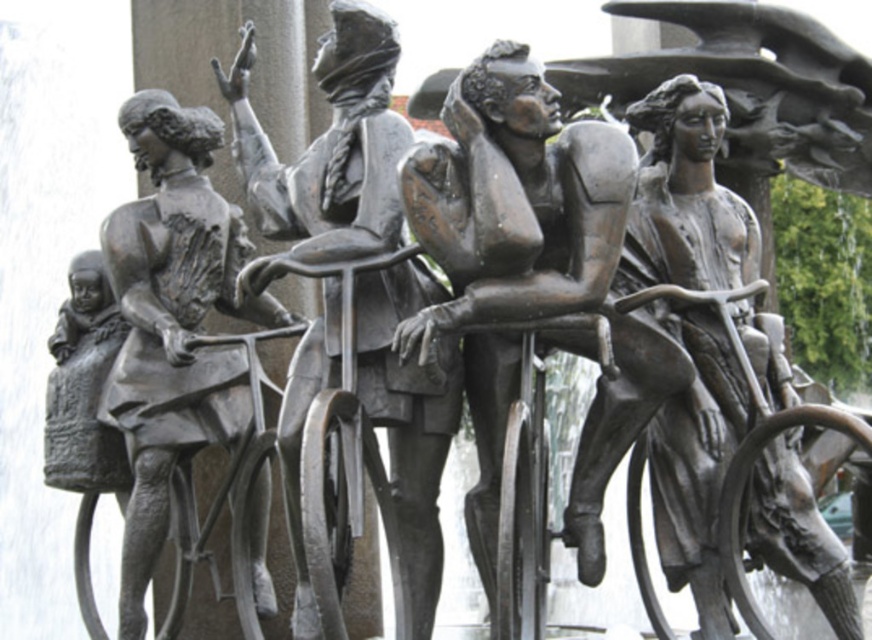
Question: From the image, what is the correct spatial relationship of polished bronze bicycle at center in relation to bronze statue of person at left?

Choices:
 (A) below
 (B) above

Answer: (B)

Question: Which point is farther from the camera taking this photo?

Choices:
 (A) (514, 193)
 (B) (358, 225)
 (C) (126, 355)

Answer: (C)

Question: Which object is farther from the camera taking this photo?

Choices:
 (A) bronze statue of person at left
 (B) bronze statue at center
 (C) polished bronze bicycle at center

Answer: (A)

Question: In this image, where is polished bronze bicycle at center located relative to bronze statue of person at left?

Choices:
 (A) below
 (B) above

Answer: (B)

Question: Based on their relative distances, which object is nearer to the bronze statue of person at left?

Choices:
 (A) bronze statue at center
 (B) polished bronze bicycle at center

Answer: (B)

Question: Is polished bronze bicycle at center bigger than bronze statue of person at left?

Choices:
 (A) no
 (B) yes

Answer: (B)